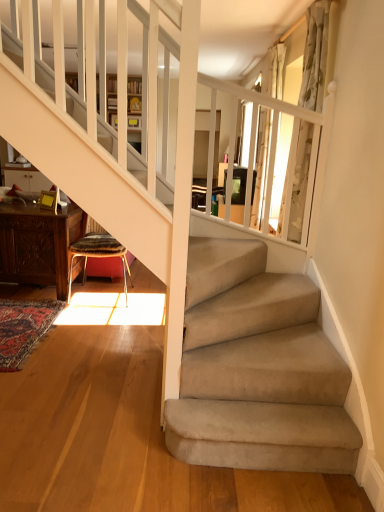
Question: Can patterned fabric stool at lower left be found inside white floral fabric curtain at upper right, the first curtain when ordered from front to back?

Choices:
 (A) yes
 (B) no

Answer: (B)

Question: Is white floral fabric curtain at upper right, the first curtain when ordered from front to back, not near patterned fabric stool at lower left?

Choices:
 (A) yes
 (B) no

Answer: (A)

Question: Can you confirm if white floral fabric curtain at upper right, which ranks as the 2th curtain in back-to-front order, is thinner than patterned fabric stool at lower left?

Choices:
 (A) no
 (B) yes

Answer: (B)

Question: From a real-world perspective, is white floral fabric curtain at upper right, which ranks as the 2th curtain in back-to-front order, located higher than patterned fabric stool at lower left?

Choices:
 (A) no
 (B) yes

Answer: (B)

Question: Is white floral fabric curtain at upper right, which ranks as the 2th curtain in back-to-front order, wider than patterned fabric stool at lower left?

Choices:
 (A) yes
 (B) no

Answer: (B)

Question: Considering the positions of carved wood table at lower left and white sheer curtain at upper right, the 2th curtain from the front, in the image, is carved wood table at lower left bigger or smaller than white sheer curtain at upper right, the 2th curtain from the front,?

Choices:
 (A) small
 (B) big

Answer: (B)

Question: From a real-world perspective, is carved wood table at lower left positioned above or below white sheer curtain at upper right, which is the first curtain in back-to-front order?

Choices:
 (A) below
 (B) above

Answer: (A)

Question: In terms of width, does carved wood table at lower left look wider or thinner when compared to white sheer curtain at upper right, which is the first curtain in back-to-front order?

Choices:
 (A) wide
 (B) thin

Answer: (A)

Question: Choose the correct answer: Is carved wood table at lower left inside white sheer curtain at upper right, which is the first curtain in back-to-front order, or outside it?

Choices:
 (A) outside
 (B) inside

Answer: (A)

Question: From a real-world perspective, is white floral fabric curtain at upper right, the first curtain when ordered from front to back, physically located above or below white sheer curtain at upper right, the 2th curtain from the front?

Choices:
 (A) below
 (B) above

Answer: (A)

Question: Is white floral fabric curtain at upper right, which ranks as the 2th curtain in back-to-front order, in front of or behind white sheer curtain at upper right, the 2th curtain from the front, in the image?

Choices:
 (A) behind
 (B) front

Answer: (B)

Question: In terms of width, does white floral fabric curtain at upper right, the first curtain when ordered from front to back, look wider or thinner when compared to white sheer curtain at upper right, which is the first curtain in back-to-front order?

Choices:
 (A) thin
 (B) wide

Answer: (B)

Question: In terms of height, does white floral fabric curtain at upper right, which ranks as the 2th curtain in back-to-front order, look taller or shorter compared to white sheer curtain at upper right, which is the first curtain in back-to-front order?

Choices:
 (A) tall
 (B) short

Answer: (A)

Question: Is point pyautogui.click(x=125, y=280) positioned closer to the camera than point pyautogui.click(x=3, y=271)?

Choices:
 (A) closer
 (B) farther

Answer: (B)

Question: From a real-world perspective, is patterned fabric stool at lower left physically located above or below carved wood table at lower left?

Choices:
 (A) above
 (B) below

Answer: (A)